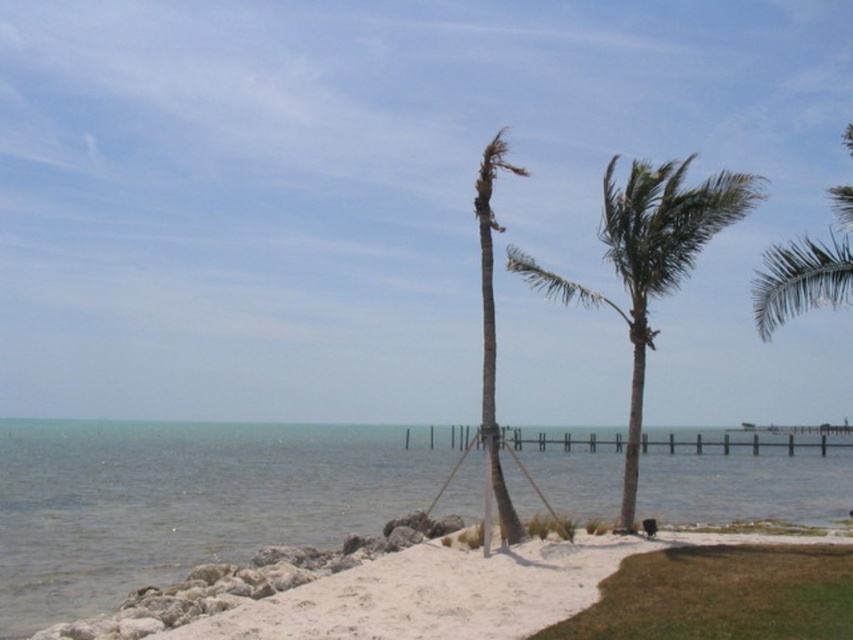
Question: Can you confirm if green leafy palm tree at center is smaller than green textured palm tree at center?

Choices:
 (A) no
 (B) yes

Answer: (A)

Question: Which of the following is the farthest from the observer?

Choices:
 (A) green leafy palm tree at center
 (B) green leafy palm tree at upper right
 (C) green textured palm tree at center

Answer: (A)

Question: Which of the following is the farthest from the observer?

Choices:
 (A) clear water at lower left
 (B) green leafy palm tree at center

Answer: (B)

Question: Based on their relative distances, which object is farther from the green leafy palm tree at upper right?

Choices:
 (A) clear water at lower left
 (B) green textured palm tree at center

Answer: (A)

Question: Can you confirm if green leafy palm tree at center is thinner than green leafy palm tree at upper right?

Choices:
 (A) no
 (B) yes

Answer: (B)

Question: Observing the image, what is the correct spatial positioning of green leafy palm tree at upper right in reference to green textured palm tree at center?

Choices:
 (A) left
 (B) right

Answer: (B)